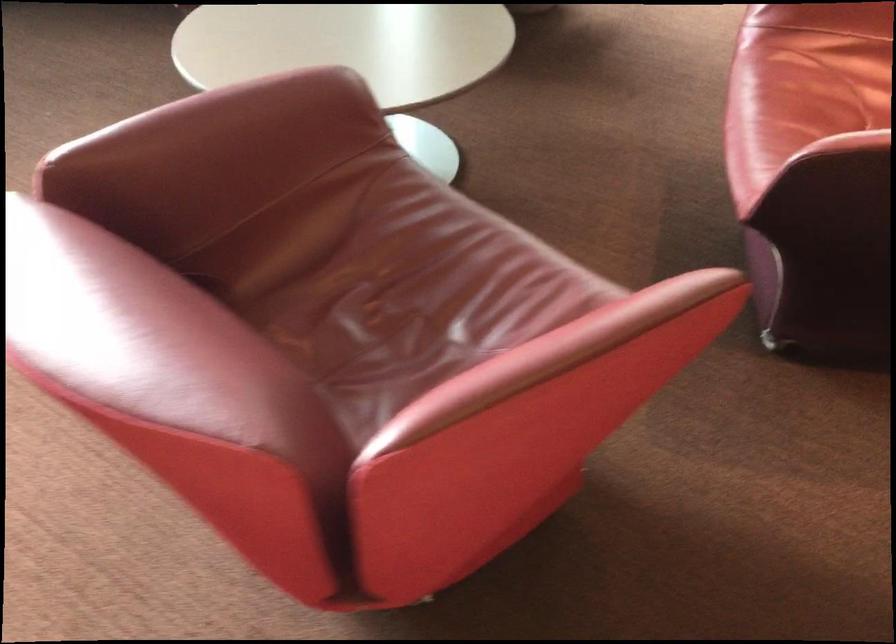
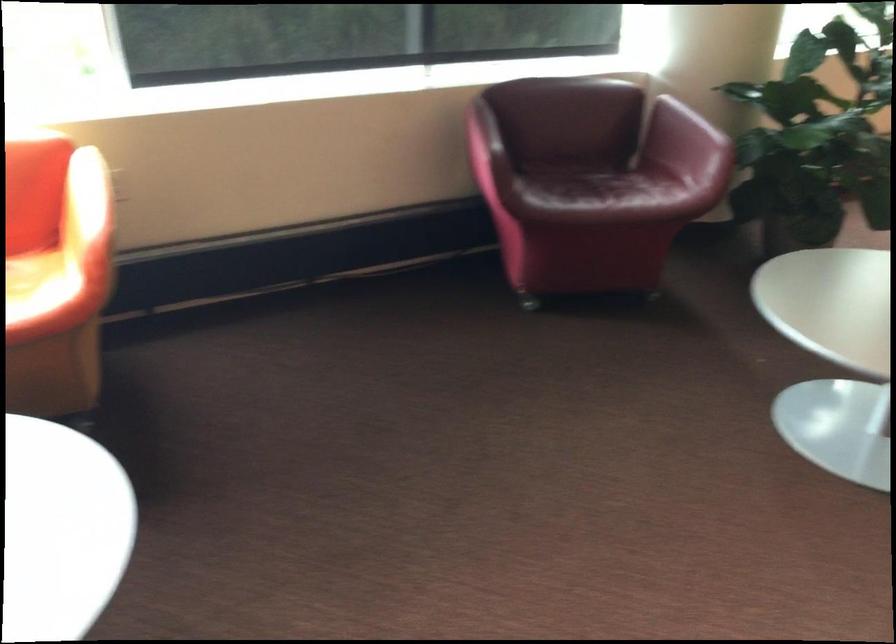
Question: The images are taken continuously from a first-person perspective. In which direction are you moving?

Choices:
 (A) Left
 (B) Right
 (C) Forward
 (D) Backward

Answer: (A)